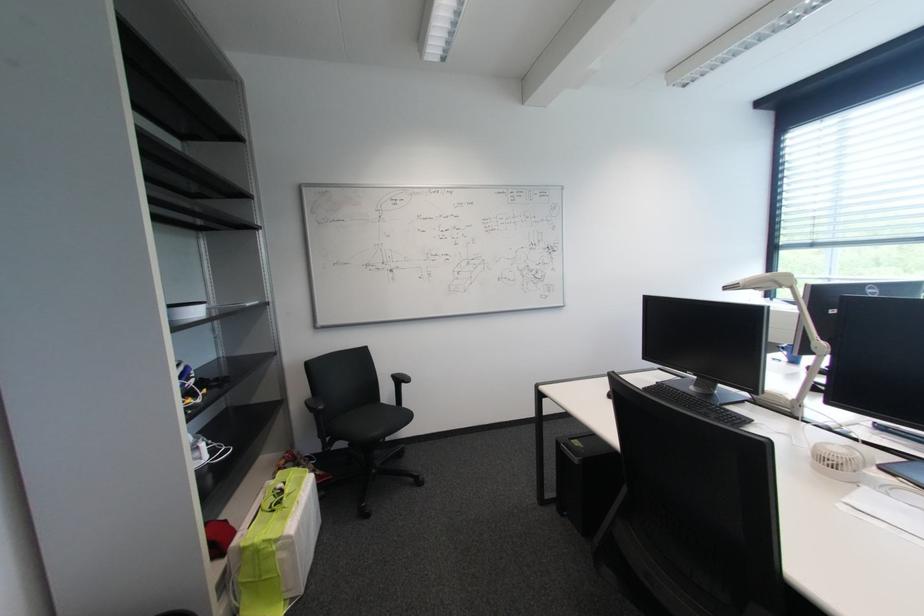
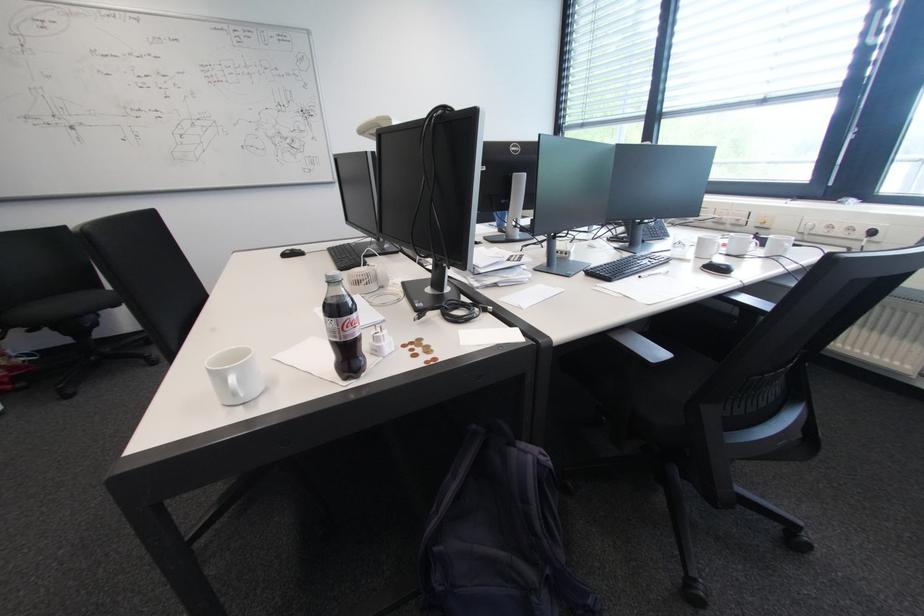
Question: The images are taken continuously from a first-person perspective. In which direction are you moving?

Choices:
 (A) Left
 (B) Right
 (C) Forward
 (D) Backward

Answer: (B)